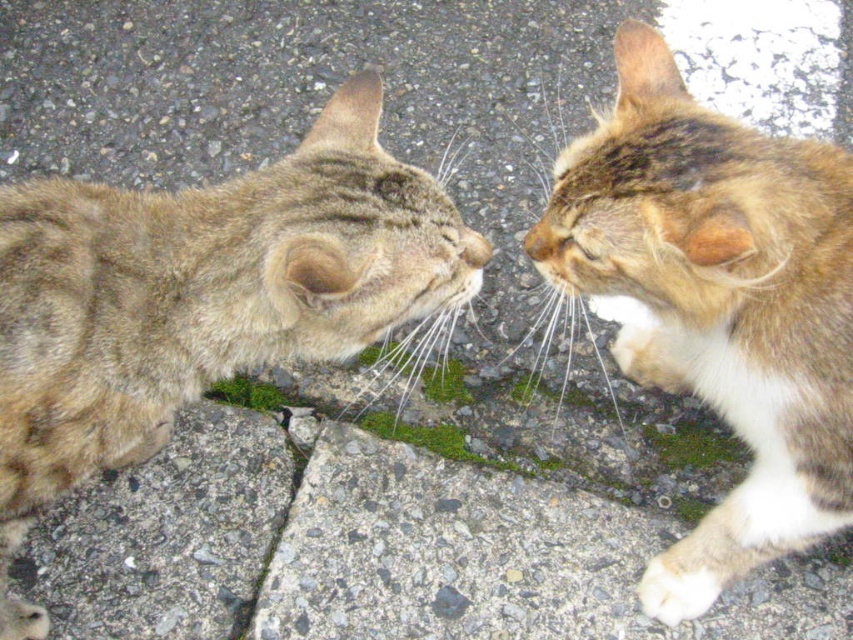
Who is positioned more to the right, tabby fur cat at center or matte fur nose at center?

Positioned to the right is matte fur nose at center.

Does tabby fur cat at center have a greater height compared to matte fur nose at center?

Yes, tabby fur cat at center is taller than matte fur nose at center.

The height and width of the screenshot is (640, 853). Identify the location of tabby fur cat at center. (198, 298).

Is brown fur nose at center to the left of matte fur nose at center from the viewer's perspective?

No, brown fur nose at center is not to the left of matte fur nose at center.

Describe the element at coordinates (540, 241) in the screenshot. I see `brown fur nose at center` at that location.

Where is `brown fur nose at center`? brown fur nose at center is located at coordinates (540, 241).

In order to click on brown fur nose at center in this screenshot , I will do `click(540, 241)`.

Is tabby fur cat at right wider than brown fur nose at center?

Yes.

Between point (663, 211) and point (537, 227), which one is positioned in front?

Positioned in front is point (663, 211).

You are a GUI agent. You are given a task and a screenshot of the screen. Output one action in this format:
    pyautogui.click(x=<x>, y=<y>)
    Task: Click on the tabby fur cat at right
    
    Given the screenshot: What is the action you would take?
    coord(718,304)